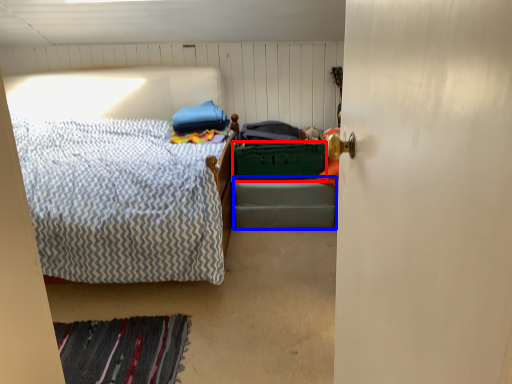
Question: Which object is closer to the camera taking this photo, laundry basket (highlighted by a red box) or bed frame (highlighted by a blue box)?

Choices:
 (A) laundry basket
 (B) bed frame

Answer: (A)